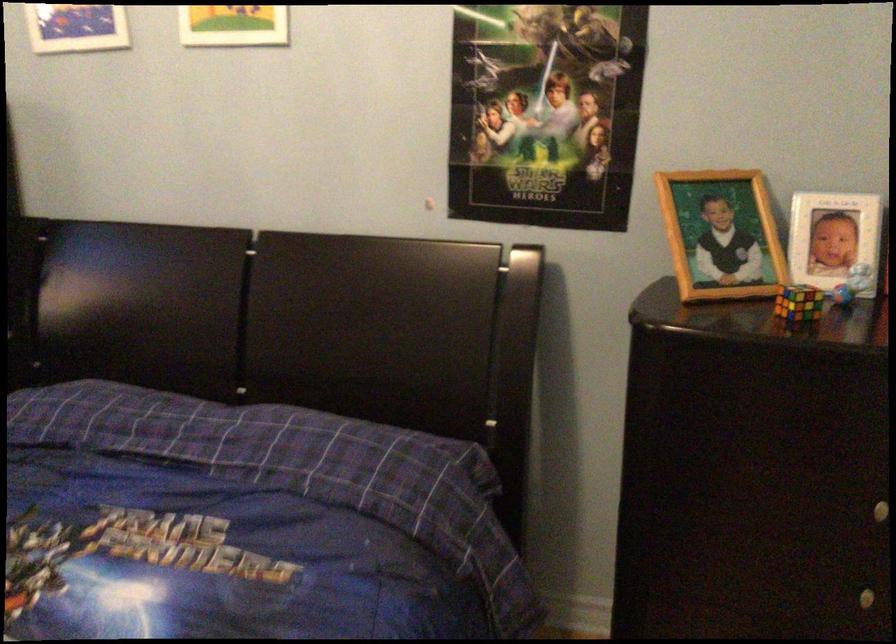
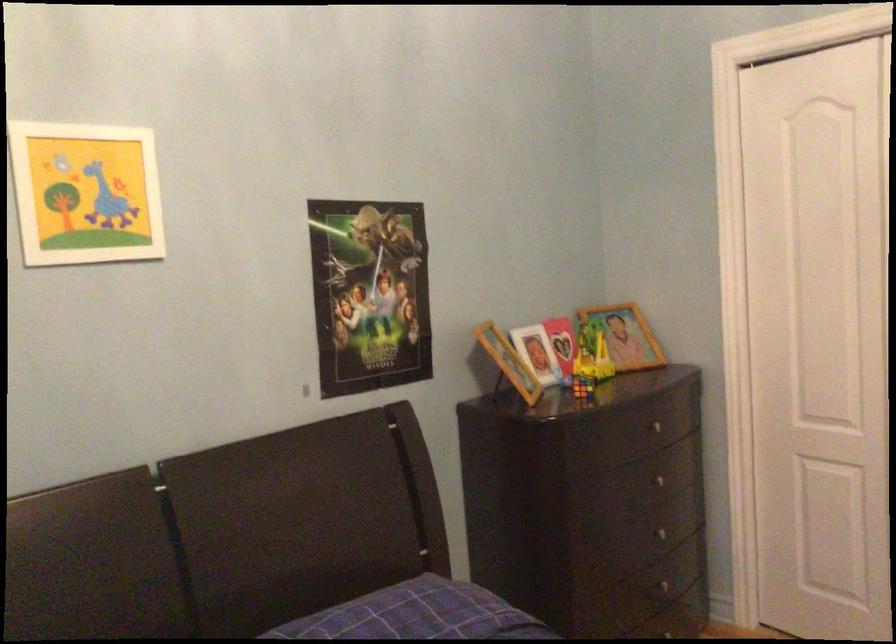
Find the pixel in the second image that matches pixel 543 111 in the first image.

(369, 294)